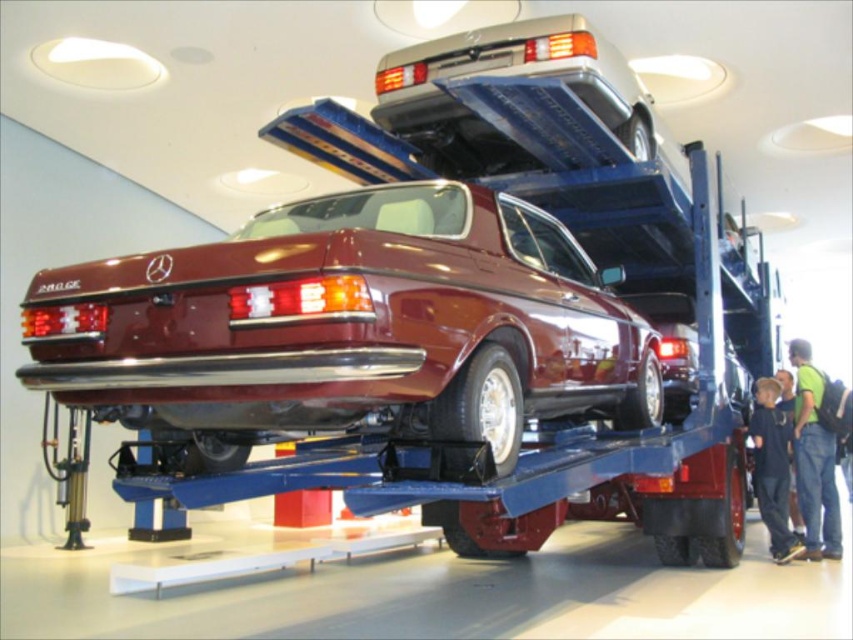
Does shiny maroon car at center have a larger size compared to green fabric shirt at lower right?

Yes, shiny maroon car at center is bigger than green fabric shirt at lower right.

Is shiny maroon car at center thinner than green fabric shirt at lower right?

Incorrect, shiny maroon car at center's width is not less than green fabric shirt at lower right's.

Between point (335, 269) and point (825, 500), which one is positioned in front?

Point (335, 269) is in front.

This screenshot has width=853, height=640. What are the coordinates of `shiny maroon car at center` in the screenshot? It's located at (349, 326).